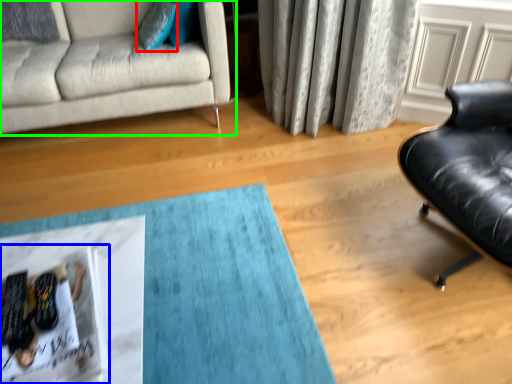
Question: Considering the real-world distances, which object is closest to pillow (highlighted by a red box)? magazine (highlighted by a blue box) or studio couch (highlighted by a green box).

Choices:
 (A) magazine
 (B) studio couch

Answer: (B)